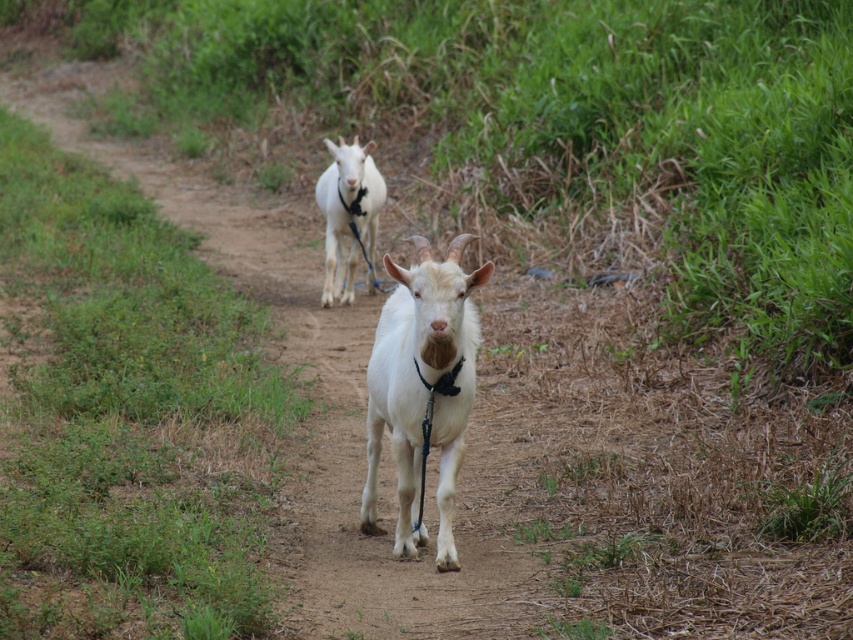
You are a photographer standing at the edge of the path. You want to take a photo of both the white matte goat at center and the white soft fur goat at center. Which goat will appear larger in the photo?

The white matte goat at center will appear larger in the photo because it is closer to the viewer than the white soft fur goat at center.

You are standing at the point marked by the coordinates point (422, 387) in the image. Looking around, you see a white matte goat at center. What is directly in front of you?

The point (422, 387) is located at the white matte goat at center, so the area directly in front of you would be the path ahead leading away from the goat.